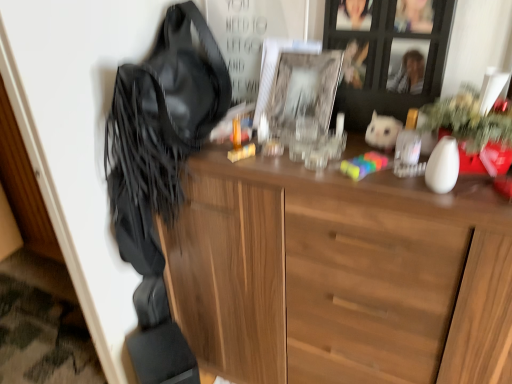
Question: Is clear glass picture frame at center oriented towards wooden cabinet at upper center?

Choices:
 (A) yes
 (B) no

Answer: (B)

Question: Can we say clear glass picture frame at center lies outside wooden cabinet at upper center?

Choices:
 (A) yes
 (B) no

Answer: (A)

Question: From a real-world perspective, is clear glass picture frame at center located beneath wooden cabinet at upper center?

Choices:
 (A) no
 (B) yes

Answer: (B)

Question: Considering the relative positions of clear glass picture frame at center and wooden cabinet at upper center in the image provided, is clear glass picture frame at center to the right of wooden cabinet at upper center from the viewer's perspective?

Choices:
 (A) no
 (B) yes

Answer: (A)

Question: Is clear glass picture frame at center further to the viewer compared to wooden cabinet at upper center?

Choices:
 (A) no
 (B) yes

Answer: (B)

Question: Considering the relative sizes of clear glass picture frame at center and wooden cabinet at upper center in the image provided, is clear glass picture frame at center taller than wooden cabinet at upper center?

Choices:
 (A) yes
 (B) no

Answer: (B)

Question: Are leather fringe at left and clear glass picture frame at center beside each other?

Choices:
 (A) yes
 (B) no

Answer: (B)

Question: From a real-world perspective, is leather fringe at left below clear glass picture frame at center?

Choices:
 (A) no
 (B) yes

Answer: (B)

Question: Considering the relative sizes of leather fringe at left and clear glass picture frame at center in the image provided, is leather fringe at left shorter than clear glass picture frame at center?

Choices:
 (A) no
 (B) yes

Answer: (A)

Question: Can you confirm if leather fringe at left is positioned to the left of clear glass picture frame at center?

Choices:
 (A) yes
 (B) no

Answer: (A)

Question: Is clear glass picture frame at center at the back of leather fringe at left?

Choices:
 (A) no
 (B) yes

Answer: (A)

Question: Is leather fringe at left far from clear glass picture frame at center?

Choices:
 (A) yes
 (B) no

Answer: (B)

Question: From the image's perspective, would you say white plush toy at upper right is shown under leather fringe at left?

Choices:
 (A) yes
 (B) no

Answer: (A)